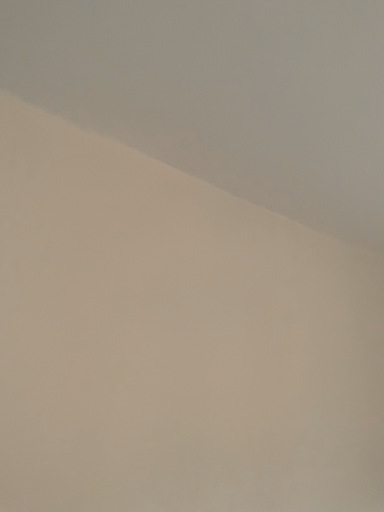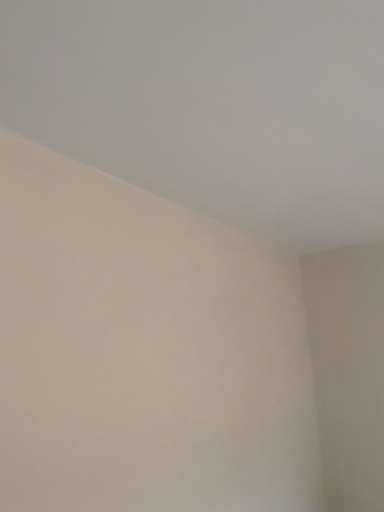
Question: Which way did the camera rotate in the video?

Choices:
 (A) rotated right
 (B) rotated left

Answer: (A)